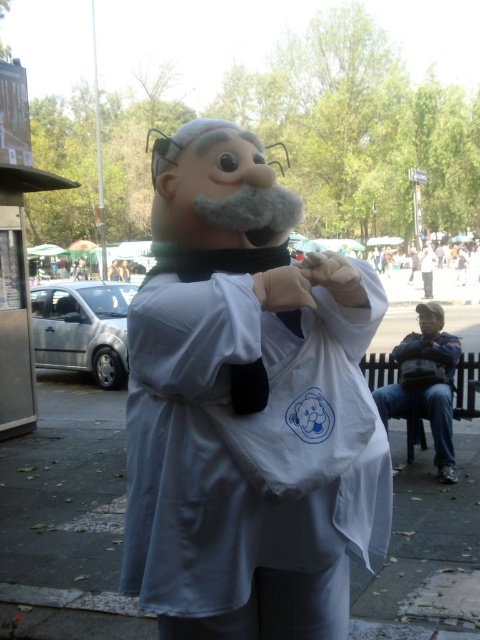
In the scene shown: You are a delivery person who needs to place a small package into either the white matte bag at center or the dark blue jeans at lower right. Based on their sizes, which one can fit the small package better?

The white matte bag at center has a smaller size compared to dark blue jeans at lower right, so the dark blue jeans at lower right can fit the small package better.

You are a delivery person who needs to place a white matte bag at center onto dark blue jeans at lower right. Will the bag fit without overlapping the jeans?

The white matte bag at center is positioned over dark blue jeans at lower right, so placing the bag there would cause overlapping with the jeans.